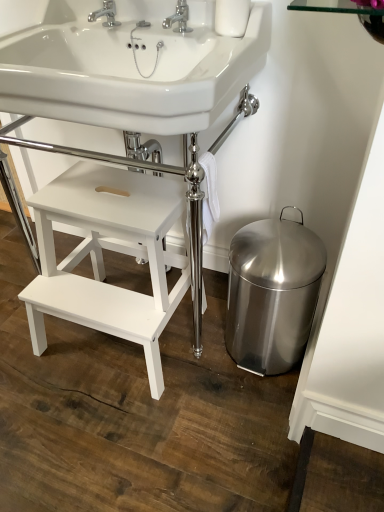
Find the location of a particular element. vacant space in front of stainless steel bidet at lower right is located at coordinates (235, 432).